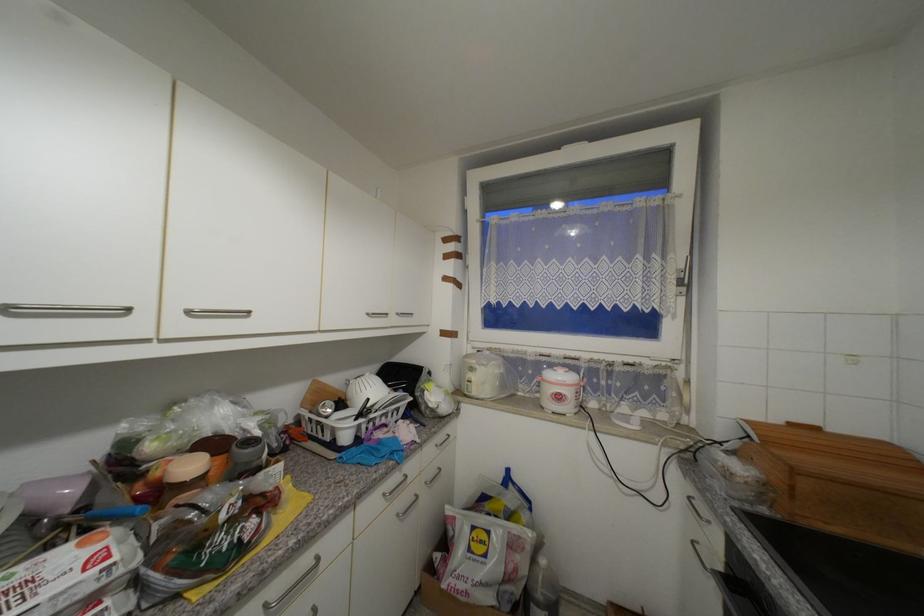
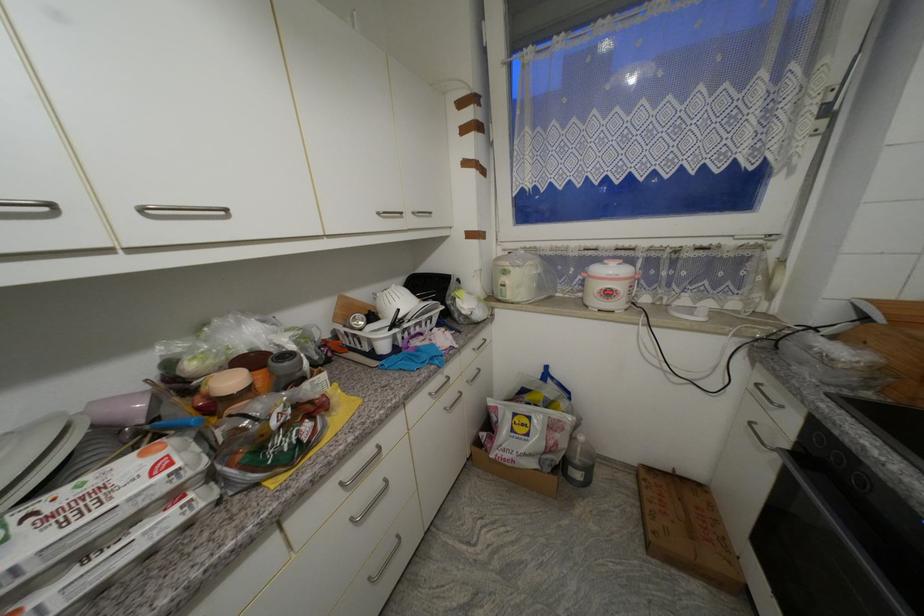
In the second image, find the point that corresponds to pixel 253 452 in the first image.

(292, 365)